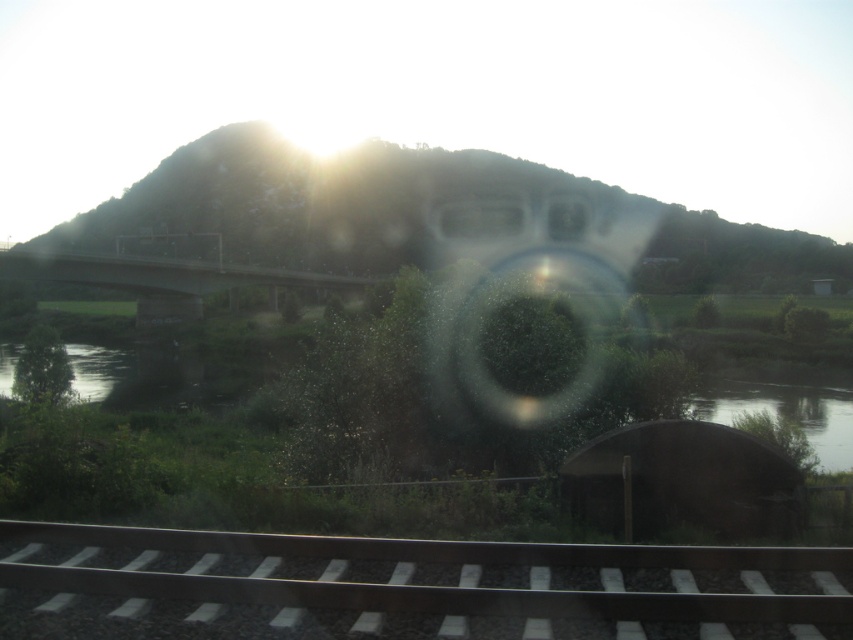
Question: Among these points, which one is nearest to the camera?

Choices:
 (A) pyautogui.click(x=155, y=259)
 (B) pyautogui.click(x=566, y=253)

Answer: (A)

Question: Which is farther from the green concrete bridge at center?

Choices:
 (A) smooth steel tracks at bottom center
 (B) transparent glass lens at center

Answer: (A)

Question: Can you confirm if smooth steel tracks at bottom center is smaller than green concrete bridge at center?

Choices:
 (A) yes
 (B) no

Answer: (A)

Question: Does smooth steel tracks at bottom center appear over green concrete bridge at center?

Choices:
 (A) no
 (B) yes

Answer: (A)

Question: Which point appears closest to the camera in this image?

Choices:
 (A) (456, 566)
 (B) (444, 224)
 (C) (140, 259)

Answer: (A)

Question: Does transparent glass lens at center appear over green concrete bridge at center?

Choices:
 (A) no
 (B) yes

Answer: (B)